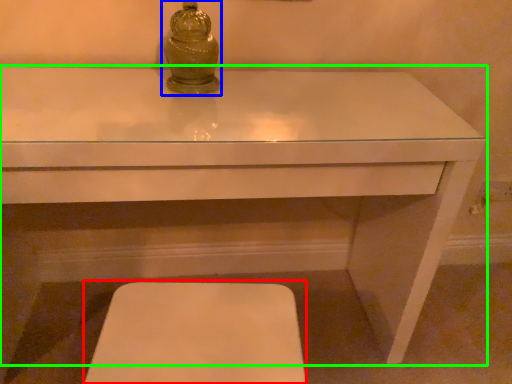
Question: Based on their relative distances, which object is nearer to step stool (highlighted by a red box)? Choose from candle holder (highlighted by a blue box) and table (highlighted by a green box).

Choices:
 (A) candle holder
 (B) table

Answer: (B)